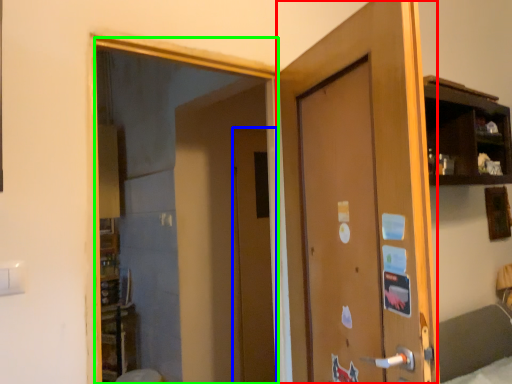
Question: Which object is positioned closest to door (highlighted by a red box)? Select from door (highlighted by a blue box) and mirror (highlighted by a green box).

Choices:
 (A) door
 (B) mirror

Answer: (B)